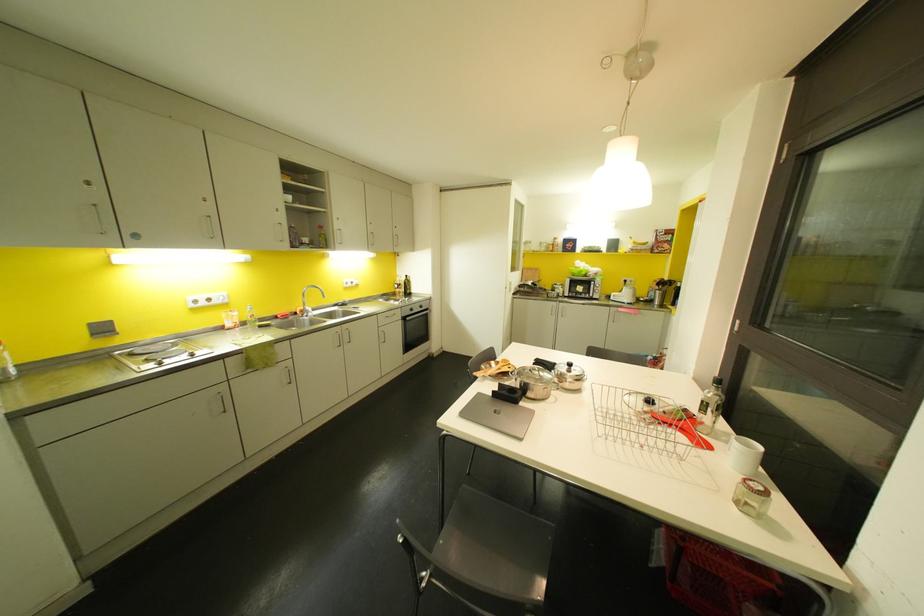
Find where to squeez the plastic bottle. Please return your answer as a coordinate pair (x, y).

(710, 407)